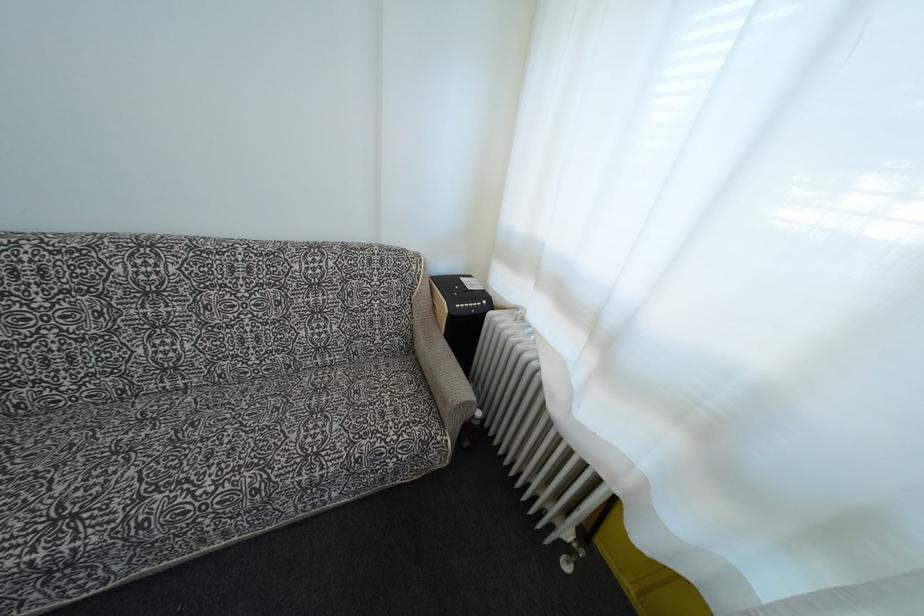
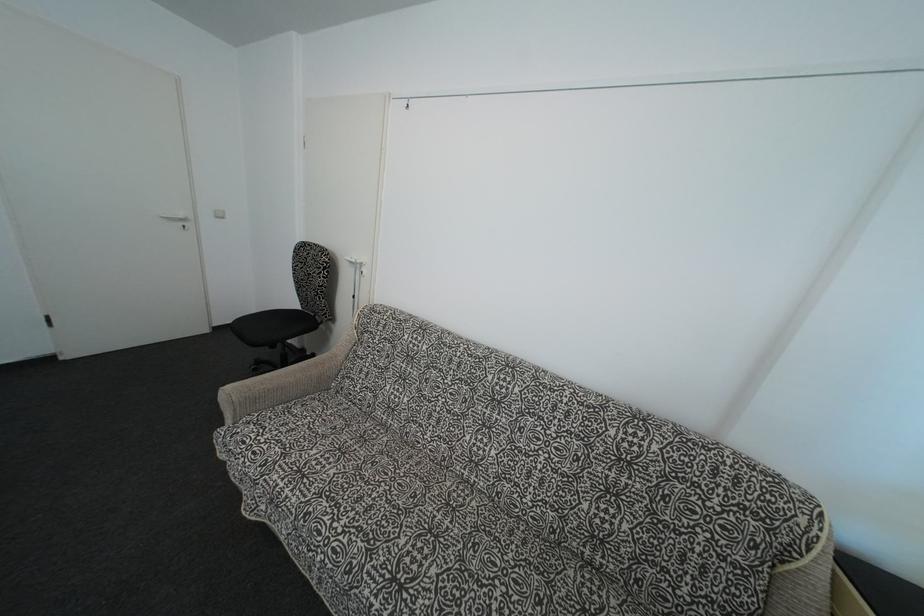
Locate, in the second image, the point that corresponds to the point at 38,538 in the first image.

(387, 583)